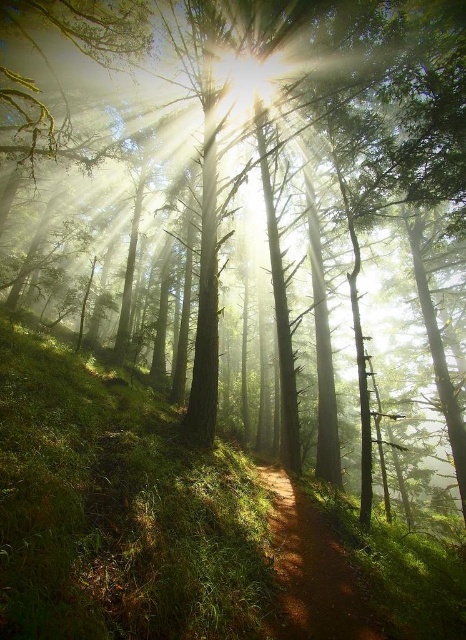
You are standing at the edge of the forest and see the dirt path at center and the bright white light at center. Which object is closer to you?

The dirt path at center is closer to you because it is in front of the bright white light at center.